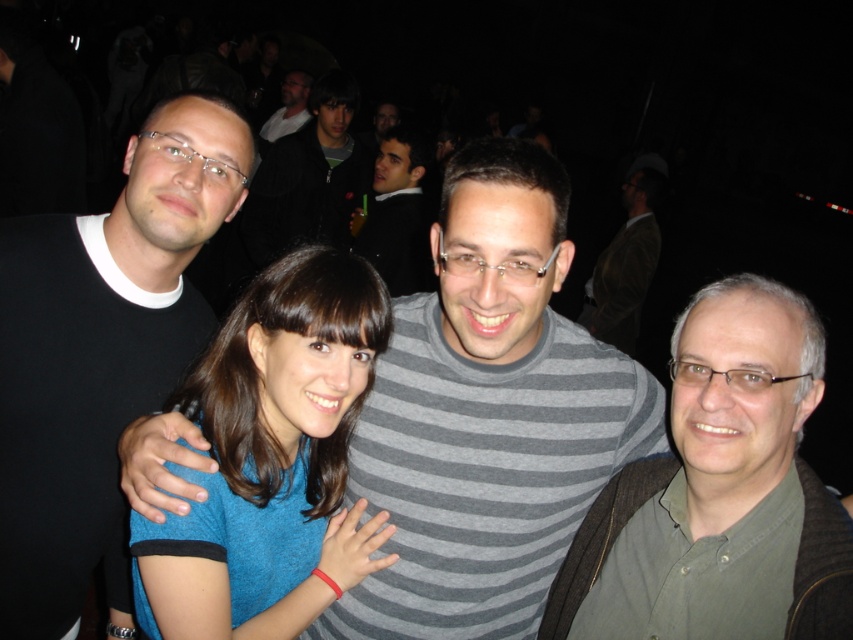
You are a photographer at the event and want to place a small LED light at the exact center between the green matte shirt at right and the man on the far left wearing a black shirt with a white collar. What are the coordinates of this midpoint?

The coordinates of the midpoint between the green matte shirt at right and the man on the far left wearing a black shirt with a white collar would be calculated by averaging their respective coordinates. However, the exact coordinates for the man on the far left are not provided in the Objects Description. Therefore, without his coordinates, it is impossible to determine the midpoint accurately.

You are a photographer trying to adjust the lighting for a group photo. You notice the green matte shirt at right and the matte black shirt at upper center. Which of these shirts is closer to the camera?

The green matte shirt at right is in front of the matte black shirt at upper center, so the green matte shirt at right is closer to the camera.

You are a photographer trying to adjust the lighting for a group photo. Since the black matte shirt at left and brown textured jacket at upper right are in the frame, which one requires more light to ensure it doesn

The black matte shirt at left requires more light because it occupies less space and might not reflect as much light as the brown textured jacket at upper right, which is larger and could naturally catch more light.